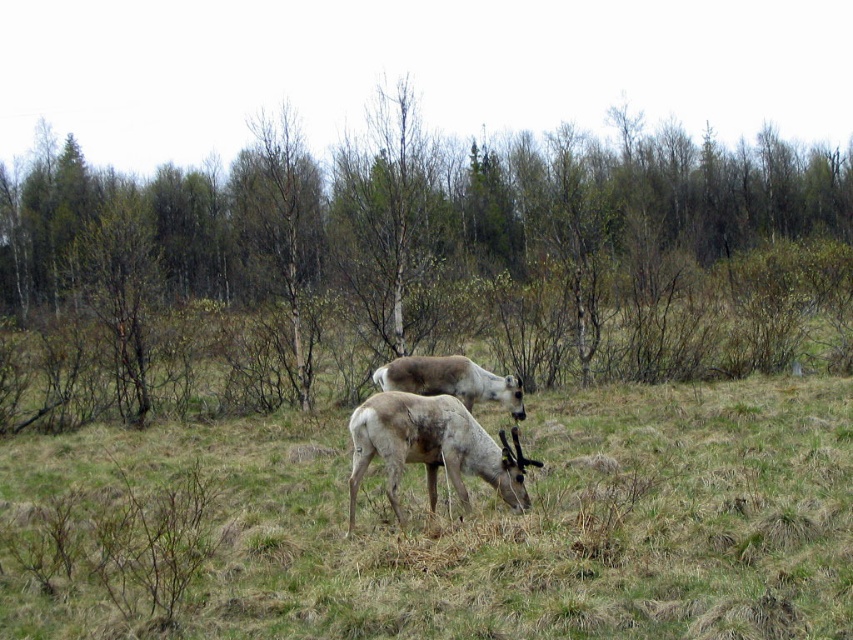
Does grayish-brown fur at center have a greater height compared to light brown fur at center?

Correct, grayish-brown fur at center is much taller as light brown fur at center.

Can you confirm if grayish-brown fur at center is shorter than light brown fur at center?

No, grayish-brown fur at center is not shorter than light brown fur at center.

Locate an element on the screen. This screenshot has height=640, width=853. grayish-brown fur at center is located at coordinates pyautogui.click(x=432, y=449).

Does brown wood tree at center have a larger size compared to grayish-brown fur at center?

Indeed, brown wood tree at center has a larger size compared to grayish-brown fur at center.

Who is more distant from viewer, (524, 368) or (357, 429)?

The point (524, 368) is more distant.

The image size is (853, 640). Identify the location of brown wood tree at center. (408, 264).

Who is shorter, brown wood tree at center or fuzzy brown reindeer at center?

fuzzy brown reindeer at center is shorter.

Who is more distant from viewer, [323,232] or [836,556]?

Point [323,232]

Identify the location of brown wood tree at center. The image size is (853, 640). (408, 264).

What are the coordinates of `brown wood tree at center` in the screenshot? It's located at (408, 264).